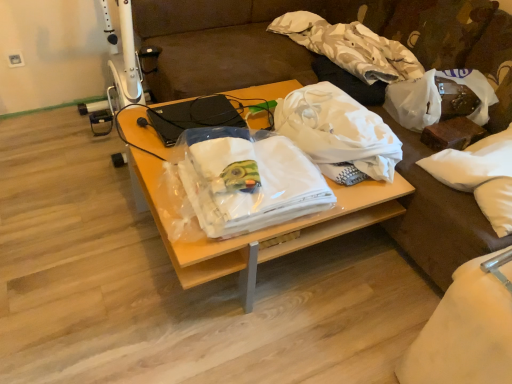
In order to click on vacant region in front of white fabric at center in this screenshot , I will do `click(221, 337)`.